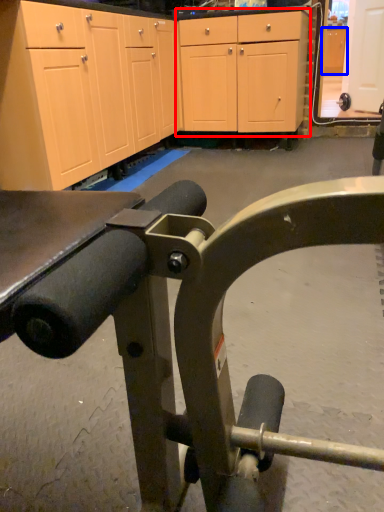
Question: Which object is further to the camera taking this photo, cabinetry (highlighted by a red box) or cabinetry (highlighted by a blue box)?

Choices:
 (A) cabinetry
 (B) cabinetry

Answer: (B)